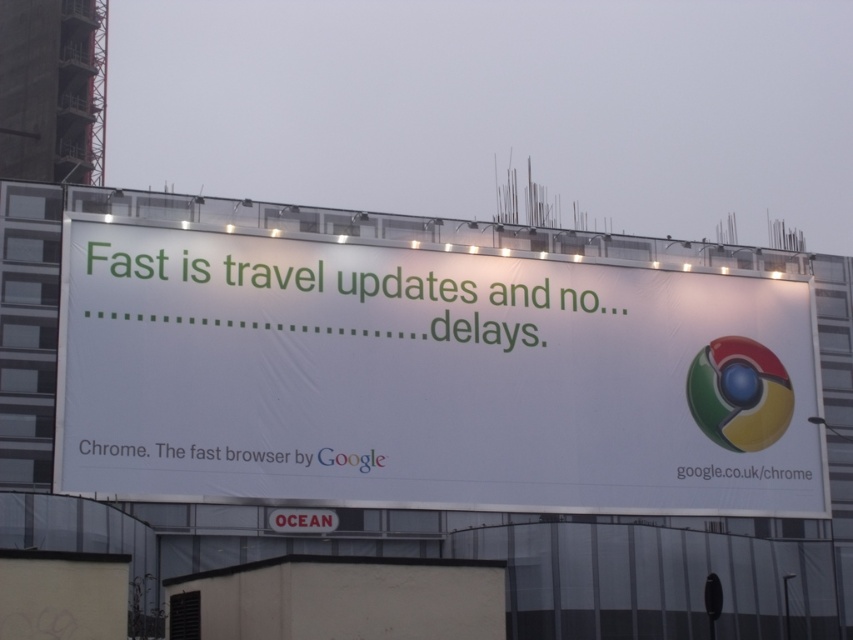
Is white paper billboard at center behind shiny chrome beach ball at right?

No, white paper billboard at center is closer to the viewer.

Does white paper billboard at center have a larger size compared to shiny chrome beach ball at right?

Yes.

Between point (561, 465) and point (717, 394), which one is positioned behind?

The point (717, 394) is behind.

Image resolution: width=853 pixels, height=640 pixels. What are the coordinates of `white paper billboard at center` in the screenshot? It's located at (428, 378).